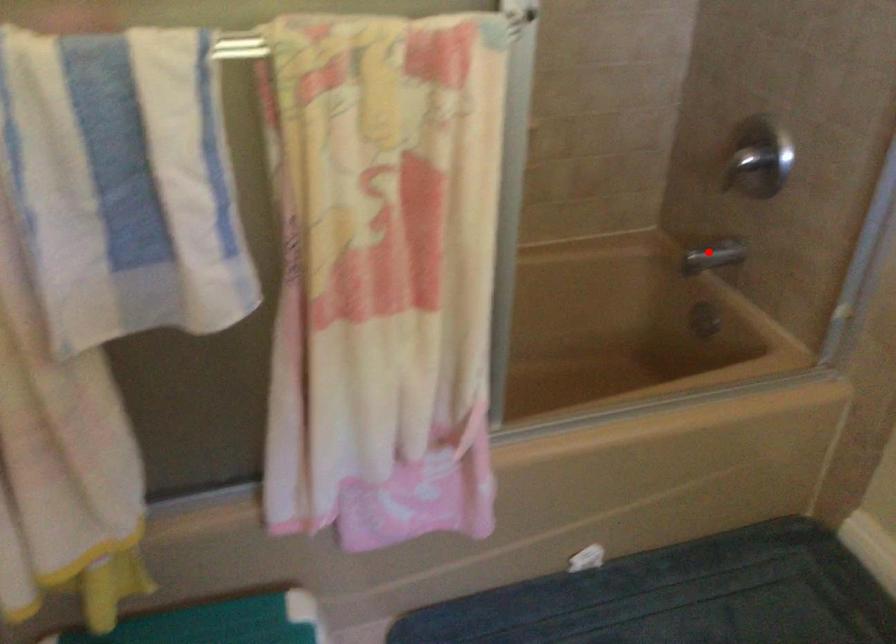
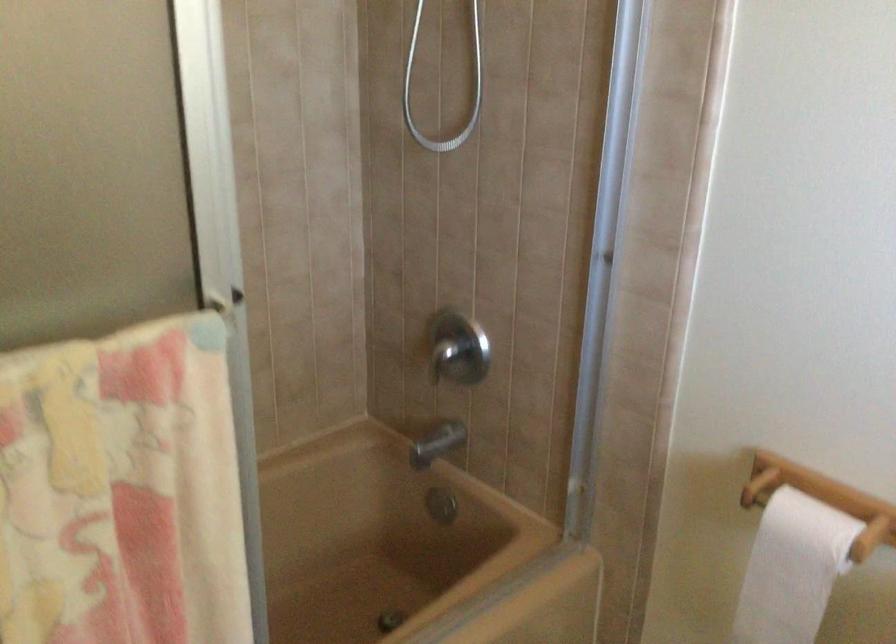
Locate, in the second image, the point that corresponds to the highlighted location in the first image.

(436, 444)